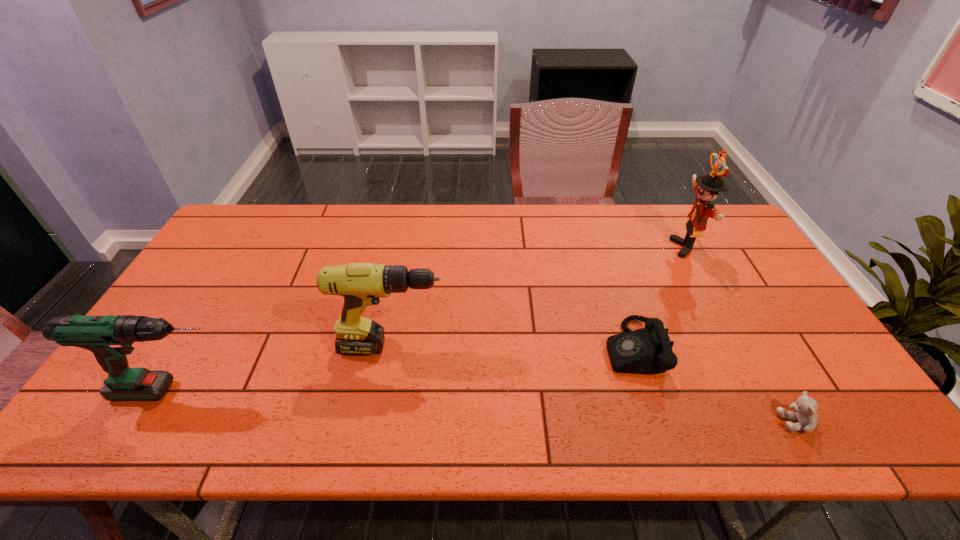
The width and height of the screenshot is (960, 540). In the image, there is a desktop. Find the location of `vacant space at the far left corner`. vacant space at the far left corner is located at coordinates (247, 208).

I want to click on free space that is in between the leftmost object and the nearest object, so click(487, 406).

This screenshot has height=540, width=960. What are the coordinates of `free spot between the tallest object and the nearer drill` in the screenshot? It's located at (431, 319).

Where is `free space between the nearest object and the telephone`? free space between the nearest object and the telephone is located at coordinates (715, 385).

Identify the location of free area in between the nutcracker and the farther drill. (540, 297).

The width and height of the screenshot is (960, 540). What are the coordinates of `free spot between the fourth object from right to left and the farthest object` in the screenshot? It's located at (540, 297).

The width and height of the screenshot is (960, 540). In order to click on blank region between the telephone and the leftmost object in this screenshot , I will do pyautogui.click(x=404, y=370).

Identify the location of free area in between the farther drill and the left drill. The width and height of the screenshot is (960, 540). (284, 369).

Locate an element on the screen. This screenshot has width=960, height=540. free space that is in between the farther drill and the teddy bear is located at coordinates (594, 384).

Find the location of `vacant area that lies between the farthest object and the right drill`. vacant area that lies between the farthest object and the right drill is located at coordinates (540, 297).